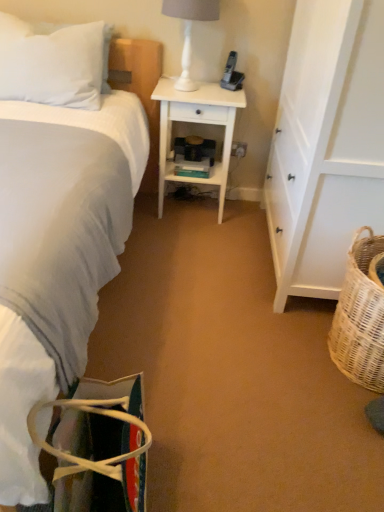
I want to click on vacant region below white glossy lamp at upper center (from a real-world perspective), so click(185, 89).